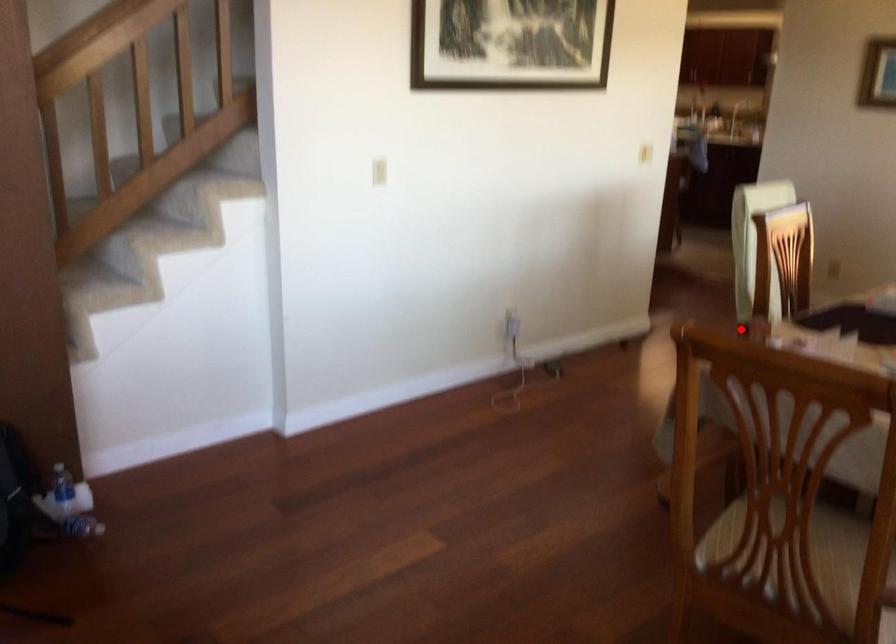
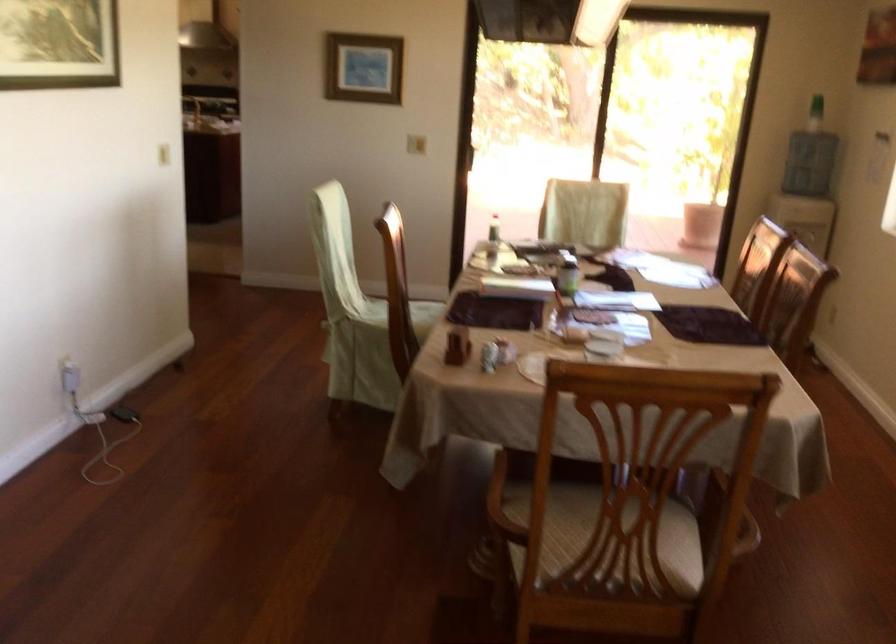
The point at the highlighted location is marked in the first image. Where is the corresponding point in the second image?

(458, 345)